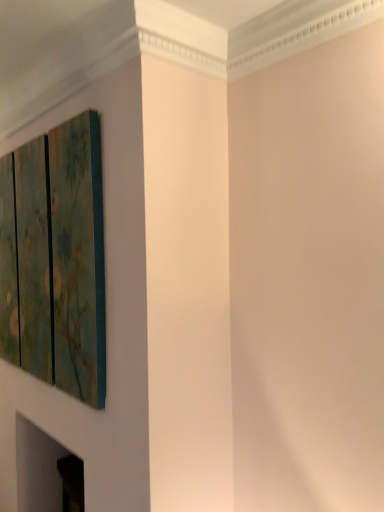
Where is `teal textured canvas at upper left`? This screenshot has height=512, width=384. teal textured canvas at upper left is located at coordinates (56, 259).

What do you see at coordinates (56, 259) in the screenshot? Image resolution: width=384 pixels, height=512 pixels. I see `teal textured canvas at upper left` at bounding box center [56, 259].

You are a GUI agent. You are given a task and a screenshot of the screen. Output one action in this format:
    pyautogui.click(x=<x>, y=<y>)
    Task: Click on the teal textured canvas at upper left
    
    Given the screenshot: What is the action you would take?
    pyautogui.click(x=56, y=259)